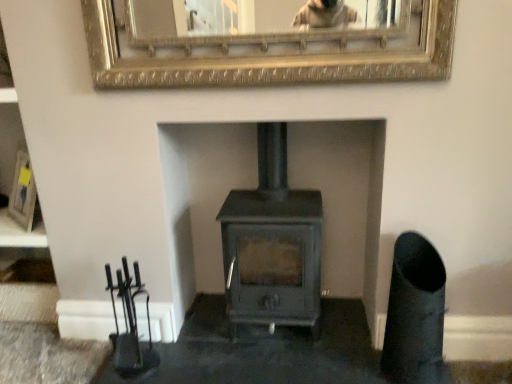
In order to face matte black picture frame at left, the first picture frame in the left-to-right sequence, should I rotate leftwards or rightwards?

You should look left and rotate roughly 31.835 degrees.

Measure the distance between gold textured mirror at upper center, the 2th picture frame from the left, and camera.

A distance of 1.33 meters exists between gold textured mirror at upper center, the 2th picture frame from the left, and camera.

Where is `gold textured mirror at upper center, which is the first picture frame from front to back`? This screenshot has width=512, height=384. gold textured mirror at upper center, which is the first picture frame from front to back is located at coordinates (268, 42).

Locate an element on the screen. The width and height of the screenshot is (512, 384). matte gray wood burning stove at center is located at coordinates (x=272, y=244).

Is there a large distance between matte gray wood burning stove at center and gold textured mirror at upper center, the first picture frame viewed from the top?

matte gray wood burning stove at center is near gold textured mirror at upper center, the first picture frame viewed from the top, not far away.

Would you say gold textured mirror at upper center, the first picture frame viewed from the top, is part of matte gray wood burning stove at center's contents?

No.

Is point (292, 246) farther from viewer compared to point (450, 65)?

That is True.

Is point (32, 214) positioned in front of point (247, 313)?

No, (32, 214) is behind (247, 313).

Does matte black picture frame at left, the 2th picture frame positioned from the front, touch matte gray wood burning stove at center?

They are not placed beside each other.

From the picture: How many degrees apart are the facing directions of matte black picture frame at left, acting as the first picture frame starting from the bottom, and matte gray wood burning stove at center?

They differ by 2.16 degrees in their facing directions.

Is matte black picture frame at left, the 2th picture frame positioned from the right, taller than matte gray wood burning stove at center?

No.

Is gold textured mirror at upper center, the first picture frame viewed from the top, further to camera compared to matte black picture frame at left, the 2th picture frame positioned from the right?

No, it is in front of matte black picture frame at left, the 2th picture frame positioned from the right.

Locate an element on the screen. Image resolution: width=512 pixels, height=384 pixels. picture frame that is below the gold textured mirror at upper center, the second picture frame ordered from the bottom (from the image's perspective) is located at coordinates (23, 192).

Who is shorter, gold textured mirror at upper center, marked as the second picture frame in a back-to-front arrangement, or matte black picture frame at left, which ranks as the 1th picture frame in back-to-front order?

gold textured mirror at upper center, marked as the second picture frame in a back-to-front arrangement, is shorter.

Based on the photo, can we say gold textured mirror at upper center, the first picture frame viewed from the top, lies outside matte black picture frame at left, placed as the 2th picture frame when sorted from top to bottom?

Yes, gold textured mirror at upper center, the first picture frame viewed from the top, is not within matte black picture frame at left, placed as the 2th picture frame when sorted from top to bottom.

Is matte gray wood burning stove at center positioned with its back to matte black picture frame at left, the first picture frame in the left-to-right sequence?

matte gray wood burning stove at center does not have its back to matte black picture frame at left, the first picture frame in the left-to-right sequence.

From a real-world perspective, which is physically below, matte gray wood burning stove at center or matte black picture frame at left, the 2th picture frame positioned from the right?

In real-world perspective, matte gray wood burning stove at center is lower.

Is matte gray wood burning stove at center not within matte black picture frame at left, the 2th picture frame positioned from the right?

matte gray wood burning stove at center is positioned outside matte black picture frame at left, the 2th picture frame positioned from the right.

Measure the distance from matte gray wood burning stove at center to matte black picture frame at left, the 2th picture frame positioned from the right.

matte gray wood burning stove at center is 4.12 feet from matte black picture frame at left, the 2th picture frame positioned from the right.

Considering the relative sizes of gold textured mirror at upper center, the 2th picture frame from the left, and matte gray wood burning stove at center in the image provided, is gold textured mirror at upper center, the 2th picture frame from the left, thinner than matte gray wood burning stove at center?

Yes.

Is gold textured mirror at upper center, marked as the second picture frame in a back-to-front arrangement, positioned with its back to matte gray wood burning stove at center?

No, gold textured mirror at upper center, marked as the second picture frame in a back-to-front arrangement, is not facing the opposite direction of matte gray wood burning stove at center.

Between gold textured mirror at upper center, the 2th picture frame from the left, and matte gray wood burning stove at center, which one appears on the right side from the viewer's perspective?

From the viewer's perspective, matte gray wood burning stove at center appears more on the right side.

Is gold textured mirror at upper center, the first picture frame viewed from the top, positioned beyond the bounds of matte gray wood burning stove at center?

Yes, gold textured mirror at upper center, the first picture frame viewed from the top, is outside of matte gray wood burning stove at center.

Is matte black picture frame at left, the 2th picture frame positioned from the front, situated inside gold textured mirror at upper center, which is the first picture frame from front to back, or outside?

The correct answer is: outside.

Does matte black picture frame at left, placed as the 2th picture frame when sorted from top to bottom, have a smaller size compared to gold textured mirror at upper center, which appears as the first picture frame when viewed from the right?

Yes.

Looking at their sizes, would you say matte black picture frame at left, which ranks as the 1th picture frame in back-to-front order, is wider or thinner than gold textured mirror at upper center, which is the first picture frame from front to back?

Considering their sizes, matte black picture frame at left, which ranks as the 1th picture frame in back-to-front order, looks broader than gold textured mirror at upper center, which is the first picture frame from front to back.

Considering the sizes of matte black picture frame at left, the first picture frame in the left-to-right sequence, and gold textured mirror at upper center, which is the first picture frame from front to back, in the image, is matte black picture frame at left, the first picture frame in the left-to-right sequence, taller or shorter than gold textured mirror at upper center, which is the first picture frame from front to back,?

Clearly, matte black picture frame at left, the first picture frame in the left-to-right sequence, is taller compared to gold textured mirror at upper center, which is the first picture frame from front to back.

From a real-world perspective, which picture frame is the 2nd one above the matte gray wood burning stove at center? Please provide its 2D coordinates.

[(268, 42)]

Find the location of a particular element. This screenshot has height=384, width=512. wood burning stove in front of the matte black picture frame at left, which ranks as the 1th picture frame in back-to-front order is located at coordinates (272, 244).

Which object lies nearer to the anchor point matte black picture frame at left, placed as the 2th picture frame when sorted from top to bottom, gold textured mirror at upper center, the first picture frame viewed from the top, or matte gray wood burning stove at center?

Among the two, matte gray wood burning stove at center is located nearer to matte black picture frame at left, placed as the 2th picture frame when sorted from top to bottom.

When comparing their distances from matte gray wood burning stove at center, does matte black picture frame at left, which ranks as the 1th picture frame in back-to-front order, or gold textured mirror at upper center, which is the first picture frame from front to back, seem further?

matte black picture frame at left, which ranks as the 1th picture frame in back-to-front order, is further to matte gray wood burning stove at center.

Considering their positions, is matte gray wood burning stove at center positioned further to matte black picture frame at left, the 2th picture frame positioned from the front, than gold textured mirror at upper center, the first picture frame viewed from the top?

The object further to matte black picture frame at left, the 2th picture frame positioned from the front, is gold textured mirror at upper center, the first picture frame viewed from the top.

Based on their spatial positions, is gold textured mirror at upper center, which appears as the first picture frame when viewed from the right, or matte black picture frame at left, the 2th picture frame positioned from the right, further from matte gray wood burning stove at center?

Based on the image, matte black picture frame at left, the 2th picture frame positioned from the right, appears to be further to matte gray wood burning stove at center.

Estimate the real-world distances between objects in this image. Which object is closer to gold textured mirror at upper center, the first picture frame viewed from the top, matte gray wood burning stove at center or matte black picture frame at left, placed as the 2th picture frame when sorted from top to bottom?

matte gray wood burning stove at center is positioned closer to the anchor gold textured mirror at upper center, the first picture frame viewed from the top.

Looking at the image, which one is located closer to gold textured mirror at upper center, which is the first picture frame from front to back, matte black picture frame at left, which ranks as the 1th picture frame in back-to-front order, or matte gray wood burning stove at center?

Among the two, matte gray wood burning stove at center is located nearer to gold textured mirror at upper center, which is the first picture frame from front to back.

At what (x,y) coordinates should I click in order to perform the action: click on picture frame between matte black picture frame at left, the 2th picture frame positioned from the right, and matte gray wood burning stove at center, in the horizontal direction. Please return your answer as a coordinate pair (x, y). Looking at the image, I should click on (268, 42).